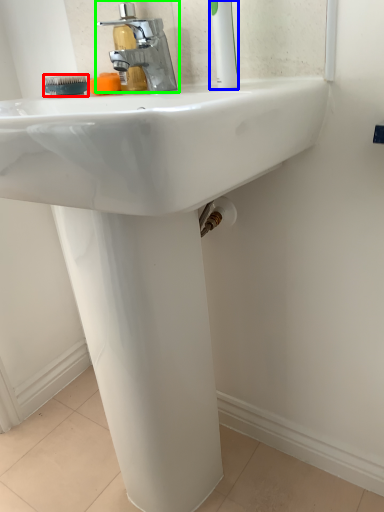
Question: Based on their relative distances, which object is nearer to brush (highlighted by a red box)? Choose from toothbrush (highlighted by a blue box) and tap (highlighted by a green box).

Choices:
 (A) toothbrush
 (B) tap

Answer: (B)